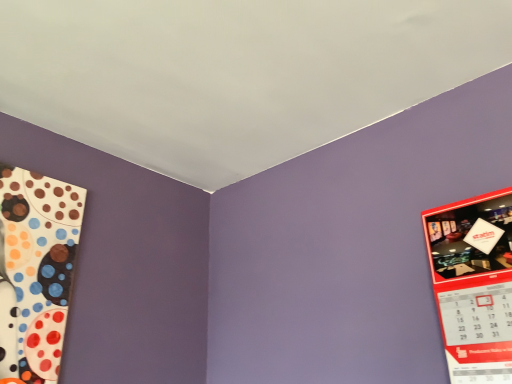
Question: Should I look upward or downward to see red glossy calendar at right?

Choices:
 (A) down
 (B) up

Answer: (A)